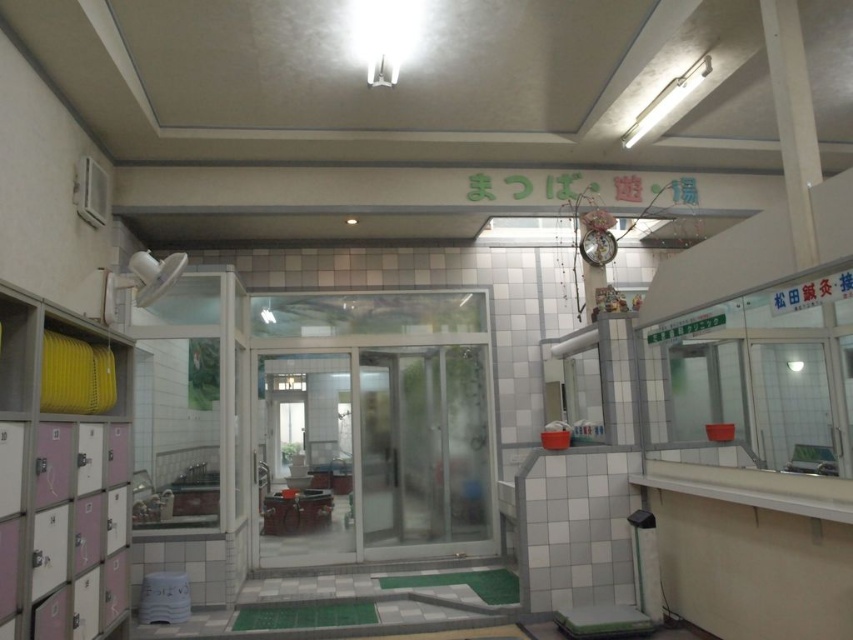
Question: Which point is closer to the camera taking this photo?

Choices:
 (A) (368, 362)
 (B) (70, 534)

Answer: (B)

Question: Which object appears farthest from the camera in this image?

Choices:
 (A) transparent plastic screen door at center
 (B) pink matte locker at left

Answer: (A)

Question: Can you confirm if pink matte locker at left is bigger than transparent plastic screen door at center?

Choices:
 (A) no
 (B) yes

Answer: (A)

Question: Is pink matte locker at left below transparent plastic screen door at center?

Choices:
 (A) no
 (B) yes

Answer: (A)

Question: Can you confirm if pink matte locker at left is positioned below transparent plastic screen door at center?

Choices:
 (A) yes
 (B) no

Answer: (B)